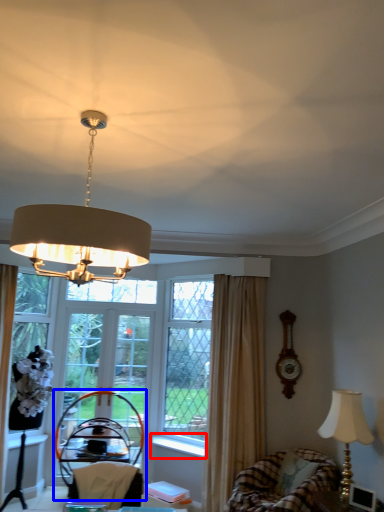
Question: Which object appears closest to the camera in this image, window sill (highlighted by a red box) or armchair (highlighted by a blue box)?

Choices:
 (A) window sill
 (B) armchair

Answer: (B)